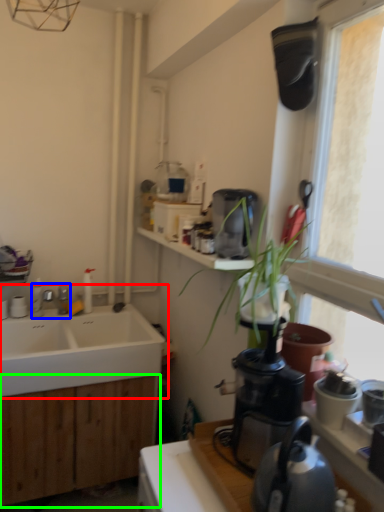
Question: Based on their relative distances, which object is farther from sink (highlighted by a red box)? Choose from tap (highlighted by a blue box) and cabinetry (highlighted by a green box).

Choices:
 (A) tap
 (B) cabinetry

Answer: (A)